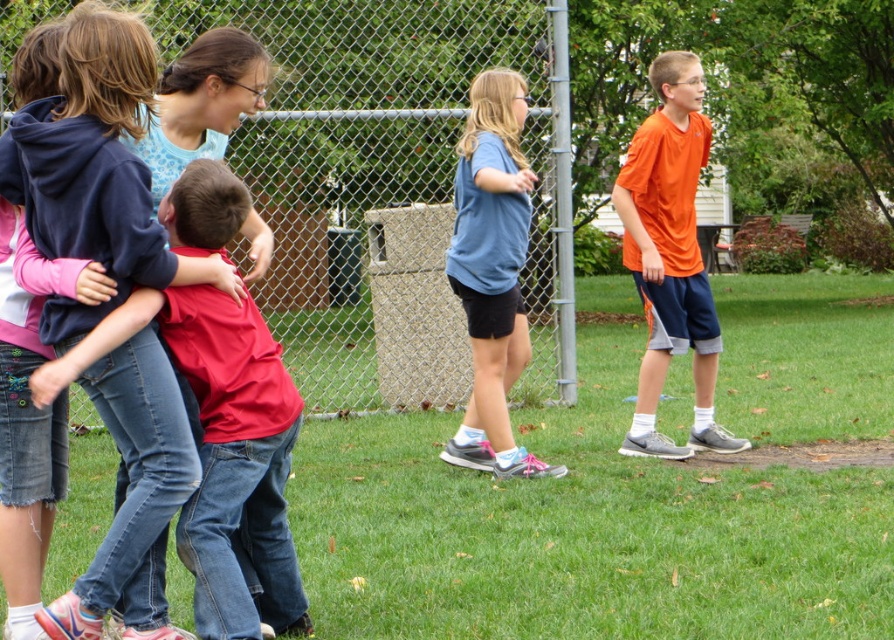
Question: Does metallic chain-link fence at upper center have a smaller size compared to orange matte shirt at right?

Choices:
 (A) yes
 (B) no

Answer: (B)

Question: Which of the following is the farthest from the observer?

Choices:
 (A) (129, 525)
 (B) (205, 374)

Answer: (B)

Question: Is metallic chain-link fence at upper center closer to the viewer compared to matte red shirt at left?

Choices:
 (A) yes
 (B) no

Answer: (B)

Question: Among these points, which one is nearest to the camera?

Choices:
 (A) (473, 154)
 (B) (704, 433)
 (C) (437, 296)
 (D) (254, 381)

Answer: (D)

Question: Which object is farther from the camera taking this photo?

Choices:
 (A) matte red shirt at left
 (B) metallic chain-link fence at upper center
 (C) blue cotton shirt at center

Answer: (C)

Question: Is metallic chain-link fence at upper center thinner than matte red shirt at center-left?

Choices:
 (A) no
 (B) yes

Answer: (A)